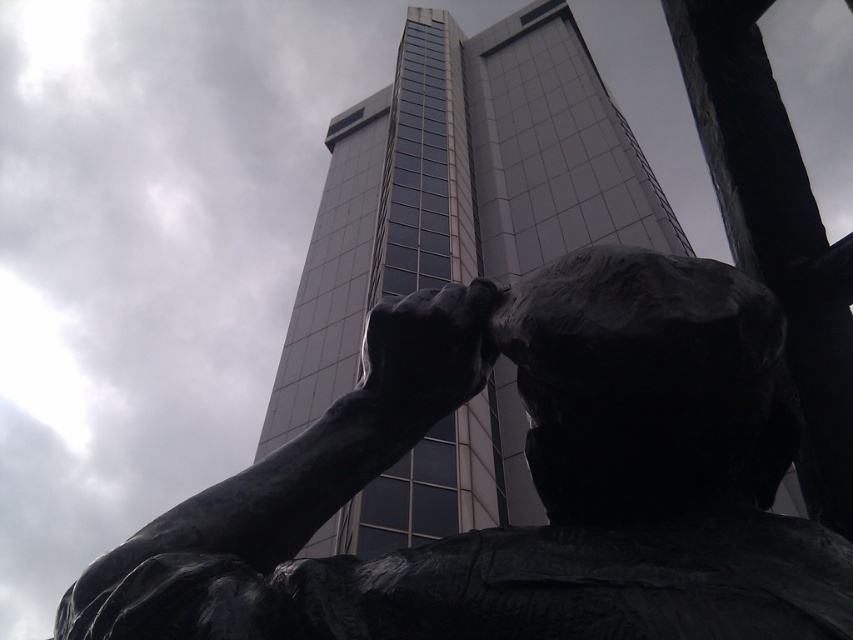
You are an urban planner reviewing this cityscape design. You need to ensure that the black polished statue at center and the smooth glass tower at center are positioned correctly according to the architectural guidelines. According to the scene, which object is closer to the observer?

The black polished statue at center is closer to the observer because it is positioned in front of the smooth glass tower at center.

Consider the image. You are an urban planner reviewing a city layout. You notice the black polished statue at center and the smooth glass tower at center in the image. Which object is positioned to the right side of the other?

The black polished statue at center is to the right of the smooth glass tower at center.